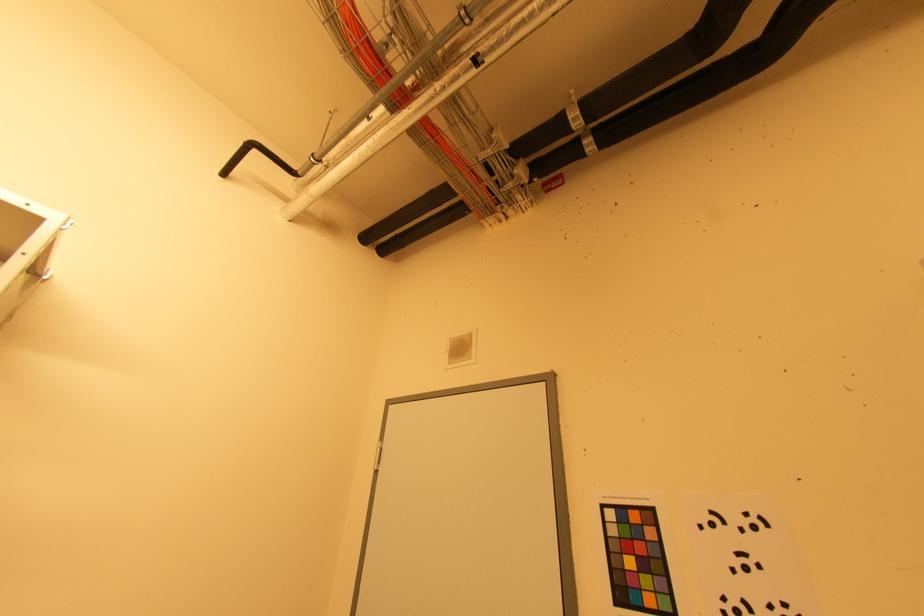
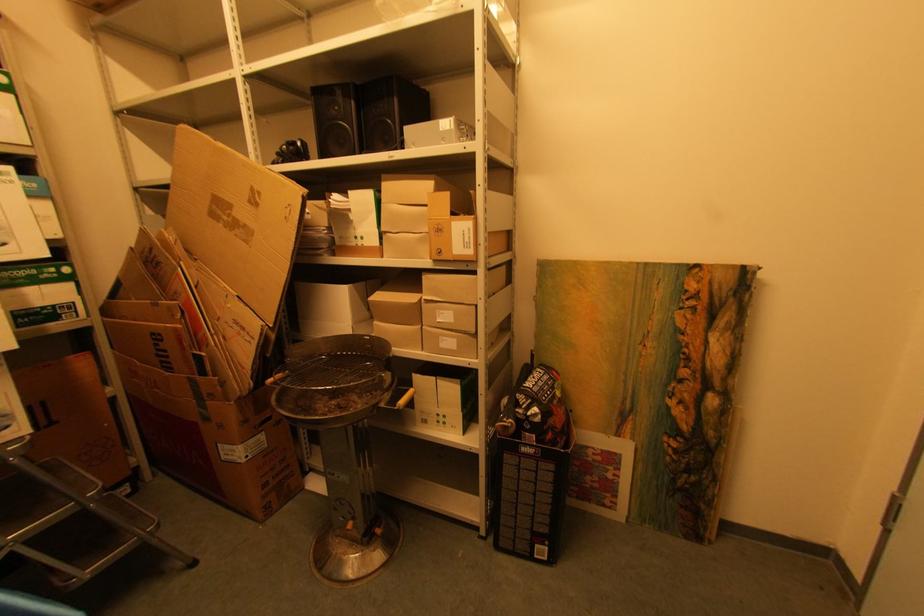
Based on the continuous images, in which direction is the camera rotating?

The camera rotated toward left-down.